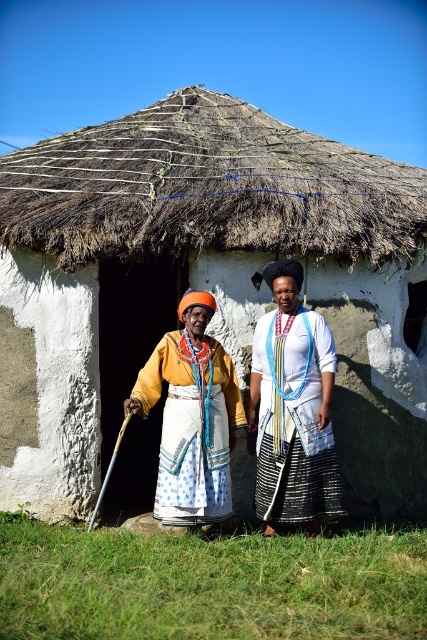
Does point (116, 140) lie behind point (201, 376)?

Yes, it is.

Who is taller, white stucco hut at center or matte yellow fabric dress at center?

matte yellow fabric dress at center

This screenshot has width=427, height=640. I want to click on white stucco hut at center, so click(201, 284).

Find the location of `white stucco hut at center`. white stucco hut at center is located at coordinates (201, 284).

Can you confirm if white stucco hut at center is bigger than thatched straw roof at center?

Indeed, white stucco hut at center has a larger size compared to thatched straw roof at center.

Which of these two, white stucco hut at center or thatched straw roof at center, stands taller?

Standing taller between the two is thatched straw roof at center.

Locate an element on the screen. white stucco hut at center is located at coordinates (201, 284).

Can you confirm if thatched straw roof at center is positioned to the right of white woven fabric dress at center?

No, thatched straw roof at center is not to the right of white woven fabric dress at center.

Can you confirm if thatched straw roof at center is positioned to the left of white woven fabric dress at center?

Correct, you'll find thatched straw roof at center to the left of white woven fabric dress at center.

What do you see at coordinates (207, 188) in the screenshot? I see `thatched straw roof at center` at bounding box center [207, 188].

You are a GUI agent. You are given a task and a screenshot of the screen. Output one action in this format:
    pyautogui.click(x=<x>, y=<y>)
    Task: Click on the thatched straw roof at center
    Image resolution: width=427 pixels, height=640 pixels.
    Given the screenshot: What is the action you would take?
    pyautogui.click(x=207, y=188)